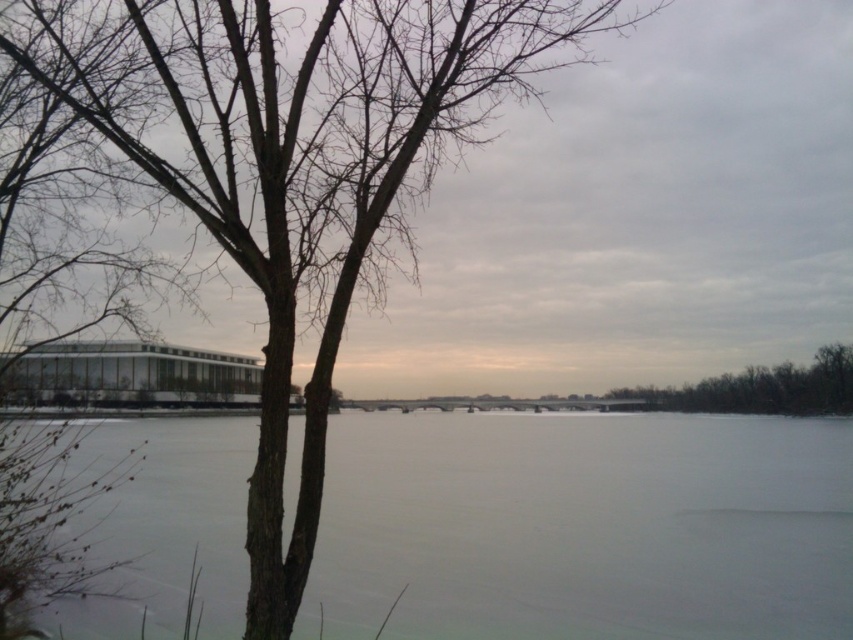
You are standing at the edge of the frozen water and want to walk to the bridge in the background. Which direction should you head towards, towards the white ice at center or the brown bark tree at right?

You should head towards the brown bark tree at right because the white ice at center is positioned on the left side of the brown bark tree at right, meaning the tree is closer to the bridge in the background.